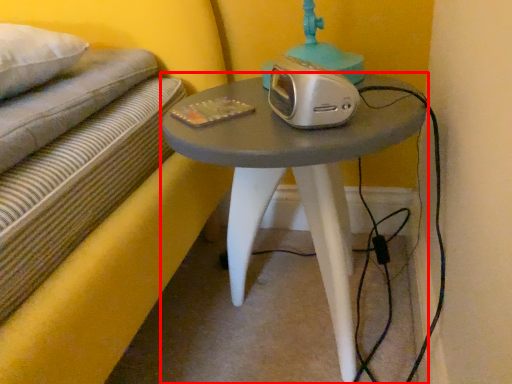
Question: In this image, where is table (annotated by the red box) located relative to stereo?

Choices:
 (A) left
 (B) right

Answer: (B)